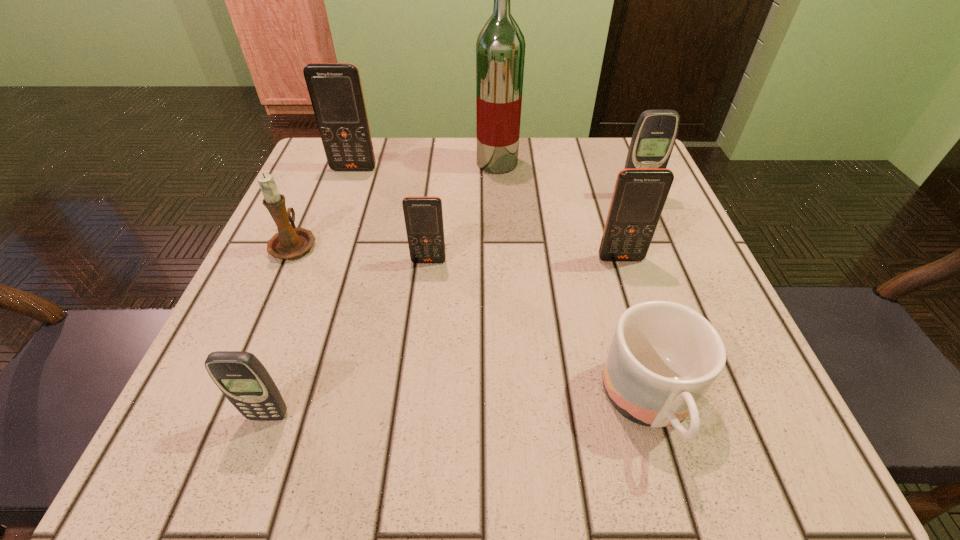
I want to click on the fourth object from right to left, so click(500, 48).

At what (x,y) coordinates should I click in order to perform the action: click on liquor. Please return your answer as a coordinate pair (x, y). The image size is (960, 540). Looking at the image, I should click on (500, 48).

This screenshot has width=960, height=540. What are the coordinates of `the leftmost orange cellular telephone` in the screenshot? It's located at (335, 90).

Where is `the biggest orange cellular telephone`? the biggest orange cellular telephone is located at coordinates (335, 90).

Locate an element on the screen. the right gray cellular telephone is located at coordinates (654, 136).

This screenshot has width=960, height=540. What are the coordinates of `the farther gray cellular telephone` in the screenshot? It's located at (654, 136).

Image resolution: width=960 pixels, height=540 pixels. What are the coordinates of `the second biggest orange cellular telephone` in the screenshot? It's located at (639, 196).

This screenshot has height=540, width=960. What are the coordinates of `candle holder` in the screenshot? It's located at (290, 242).

This screenshot has height=540, width=960. I want to click on the smallest orange cellular telephone, so click(x=423, y=216).

This screenshot has width=960, height=540. I want to click on the third cellular telephone from right to left, so click(x=423, y=216).